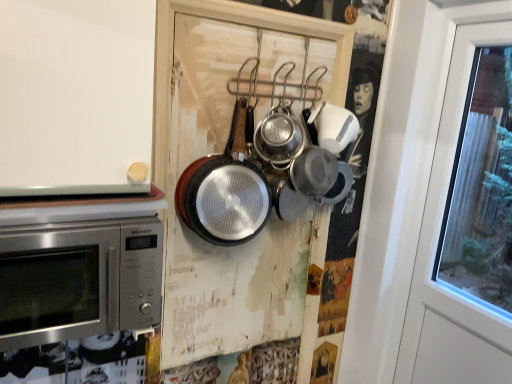
How much space does black textured frying pan at center, which ranks as the second frying pan in right-to-left order, occupy vertically?

black textured frying pan at center, which ranks as the second frying pan in right-to-left order, is 17.85 inches in height.

Measure the distance between black textured frying pan at center, which ranks as the second frying pan in right-to-left order, and camera.

black textured frying pan at center, which ranks as the second frying pan in right-to-left order, is 1.27 meters away from camera.

Locate an element on the screen. stainless steel microwave at left is located at coordinates (79, 280).

Is silver textured frying pan at center, placed as the 2th frying pan when sorted from left to right, far away from stainless steel microwave at left?

silver textured frying pan at center, placed as the 2th frying pan when sorted from left to right, is near stainless steel microwave at left, not far away.

Is silver textured frying pan at center, the 1th frying pan when ordered from right to left, taller or shorter than stainless steel microwave at left?

silver textured frying pan at center, the 1th frying pan when ordered from right to left, is shorter than stainless steel microwave at left.

From a real-world perspective, is silver textured frying pan at center, the 1th frying pan when ordered from right to left, physically below stainless steel microwave at left?

Actually, silver textured frying pan at center, the 1th frying pan when ordered from right to left, is physically above stainless steel microwave at left in the real world.

In terms of size, does silver textured frying pan at center, placed as the 2th frying pan when sorted from left to right, appear bigger or smaller than stainless steel microwave at left?

Considering their sizes, silver textured frying pan at center, placed as the 2th frying pan when sorted from left to right, takes up less space than stainless steel microwave at left.

Considering the points (222, 196) and (135, 317), which point is in front, point (222, 196) or point (135, 317)?

The point (135, 317) is closer to the camera.

Locate an element on the screen. This screenshot has height=384, width=512. microwave oven beneath the black textured frying pan at center, which ranks as the second frying pan in right-to-left order (from a real-world perspective) is located at coordinates (79, 280).

From a real-world perspective, which object rests below the other?

stainless steel microwave at left is physically lower.

Can you tell me how much black textured frying pan at center, acting as the first frying pan starting from the left, and stainless steel microwave at left differ in facing direction?

1.41 degrees.

From the image's perspective, is stainless steel microwave at left under silver textured frying pan at center, placed as the 2th frying pan when sorted from left to right?

Yes.

Is stainless steel microwave at left not near silver textured frying pan at center, the 1th frying pan when ordered from right to left?

No.

Looking at this image, which is more to the right, stainless steel microwave at left or silver textured frying pan at center, placed as the 2th frying pan when sorted from left to right?

From the viewer's perspective, silver textured frying pan at center, placed as the 2th frying pan when sorted from left to right, appears more on the right side.

From a real-world perspective, relative to black textured frying pan at center, which ranks as the second frying pan in right-to-left order, is stainless steel microwave at left vertically above or below?

From a real-world perspective, stainless steel microwave at left is physically below black textured frying pan at center, which ranks as the second frying pan in right-to-left order.

Is stainless steel microwave at left aimed at black textured frying pan at center, which ranks as the second frying pan in right-to-left order?

No, stainless steel microwave at left is not aimed at black textured frying pan at center, which ranks as the second frying pan in right-to-left order.

Considering the sizes of stainless steel microwave at left and black textured frying pan at center, acting as the first frying pan starting from the left, in the image, is stainless steel microwave at left bigger or smaller than black textured frying pan at center, acting as the first frying pan starting from the left,?

In the image, stainless steel microwave at left appears to be larger than black textured frying pan at center, acting as the first frying pan starting from the left.

Does black textured frying pan at center, which ranks as the second frying pan in right-to-left order, come in front of silver textured frying pan at center, placed as the 2th frying pan when sorted from left to right?

Yes, black textured frying pan at center, which ranks as the second frying pan in right-to-left order, is closer to the viewer.

Which is behind, point (224, 183) or point (294, 128)?

The point (294, 128) is more distant.

Is silver textured frying pan at center, placed as the 2th frying pan when sorted from left to right, surrounded by black textured frying pan at center, acting as the first frying pan starting from the left?

No, silver textured frying pan at center, placed as the 2th frying pan when sorted from left to right, is located outside of black textured frying pan at center, acting as the first frying pan starting from the left.

Looking at this image, is silver textured frying pan at center, placed as the 2th frying pan when sorted from left to right, at the left side of black textured frying pan at center, acting as the first frying pan starting from the left?

In fact, silver textured frying pan at center, placed as the 2th frying pan when sorted from left to right, is to the right of black textured frying pan at center, acting as the first frying pan starting from the left.

Considering the sizes of objects silver textured frying pan at center, the 1th frying pan when ordered from right to left, and black textured frying pan at center, which ranks as the second frying pan in right-to-left order, in the image provided, who is bigger, silver textured frying pan at center, the 1th frying pan when ordered from right to left, or black textured frying pan at center, which ranks as the second frying pan in right-to-left order,?

black textured frying pan at center, which ranks as the second frying pan in right-to-left order, is bigger.

Would you say silver textured frying pan at center, placed as the 2th frying pan when sorted from left to right, contains black textured frying pan at center, acting as the first frying pan starting from the left?

Actually, black textured frying pan at center, acting as the first frying pan starting from the left, is outside silver textured frying pan at center, placed as the 2th frying pan when sorted from left to right.

From a real-world perspective, is silver textured frying pan at center, the 1th frying pan when ordered from right to left, beneath black textured frying pan at center, acting as the first frying pan starting from the left?

Incorrect, from a real-world perspective, silver textured frying pan at center, the 1th frying pan when ordered from right to left, is higher than black textured frying pan at center, acting as the first frying pan starting from the left.

You are a GUI agent. You are given a task and a screenshot of the screen. Output one action in this format:
    pyautogui.click(x=<x>, y=<y>)
    Task: Click on the 2nd frying pan behind when counting from the stainless steel microwave at left
    This screenshot has width=512, height=384.
    Given the screenshot: What is the action you would take?
    pyautogui.click(x=279, y=131)

From the image's perspective, count 1st frying pans upward from the stainless steel microwave at left and point to it. Please provide its 2D coordinates.

[(226, 189)]

Considering their positions, is stainless steel microwave at left positioned further to black textured frying pan at center, acting as the first frying pan starting from the left, than silver textured frying pan at center, the 1th frying pan when ordered from right to left?

Among the two, stainless steel microwave at left is located further to black textured frying pan at center, acting as the first frying pan starting from the left.

Estimate the real-world distances between objects in this image. Which object is closer to silver textured frying pan at center, placed as the 2th frying pan when sorted from left to right, stainless steel microwave at left or black textured frying pan at center, acting as the first frying pan starting from the left?

black textured frying pan at center, acting as the first frying pan starting from the left, is positioned closer to the anchor silver textured frying pan at center, placed as the 2th frying pan when sorted from left to right.

Estimate the real-world distances between objects in this image. Which object is closer to stainless steel microwave at left, silver textured frying pan at center, placed as the 2th frying pan when sorted from left to right, or black textured frying pan at center, acting as the first frying pan starting from the left?

Based on the image, black textured frying pan at center, acting as the first frying pan starting from the left, appears to be nearer to stainless steel microwave at left.

Looking at the image, which one is located closer to stainless steel microwave at left, black textured frying pan at center, which ranks as the second frying pan in right-to-left order, or silver textured frying pan at center, placed as the 2th frying pan when sorted from left to right?

black textured frying pan at center, which ranks as the second frying pan in right-to-left order.

Which object lies further to the anchor point black textured frying pan at center, which ranks as the second frying pan in right-to-left order, silver textured frying pan at center, the 1th frying pan when ordered from right to left, or stainless steel microwave at left?

stainless steel microwave at left is further to black textured frying pan at center, which ranks as the second frying pan in right-to-left order.

Considering their positions, is black textured frying pan at center, acting as the first frying pan starting from the left, positioned further to silver textured frying pan at center, the 1th frying pan when ordered from right to left, than stainless steel microwave at left?

The object further to silver textured frying pan at center, the 1th frying pan when ordered from right to left, is stainless steel microwave at left.

Locate an element on the screen. This screenshot has height=384, width=512. frying pan between stainless steel microwave at left and silver textured frying pan at center, the 1th frying pan when ordered from right to left, in the front-back direction is located at coordinates (226, 189).